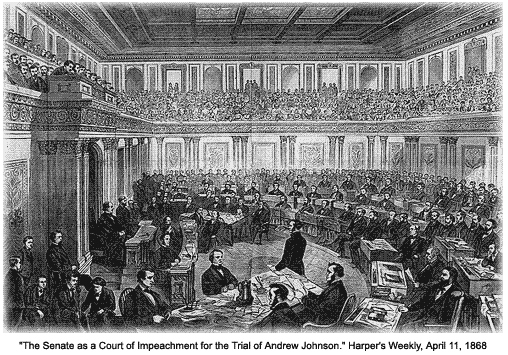
Locate an element on the screen. This screenshot has height=355, width=508. floor is located at coordinates (239, 249).